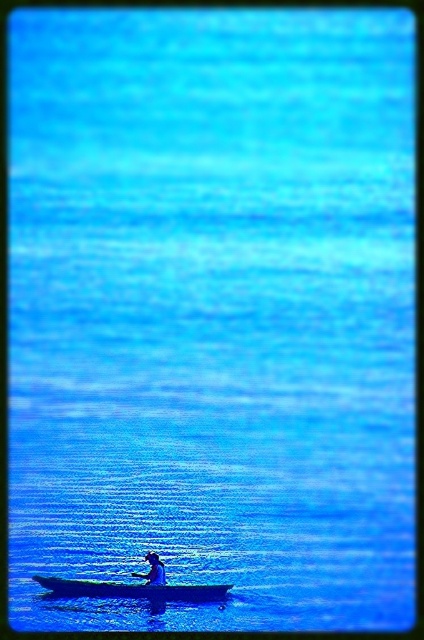
Question: Which point is farther from the camera taking this photo?

Choices:
 (A) (92, 588)
 (B) (141, 573)

Answer: (A)

Question: Is dark blue wood canoe at center further to the viewer compared to blue matte person at center?

Choices:
 (A) no
 (B) yes

Answer: (B)

Question: Is the position of dark blue wood canoe at center more distant than that of blue matte person at center?

Choices:
 (A) yes
 (B) no

Answer: (A)

Question: Is dark blue wood canoe at center bigger than blue matte person at center?

Choices:
 (A) no
 (B) yes

Answer: (B)